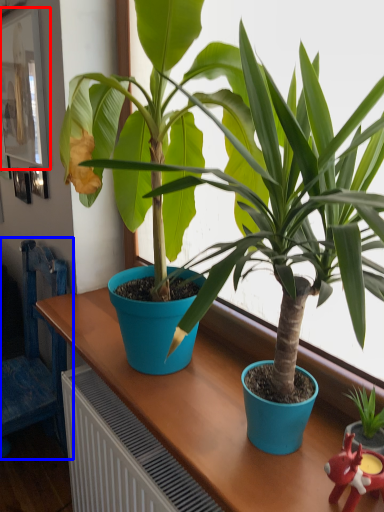
Question: Which of the following is the closest to the observer, picture frame (highlighted by a red box) or chair (highlighted by a blue box)?

Choices:
 (A) picture frame
 (B) chair

Answer: (B)